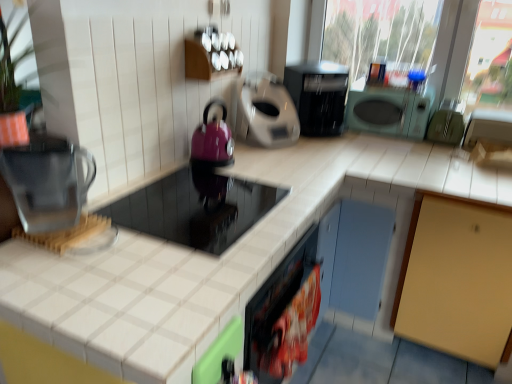
Question: From the image's perspective, is matte purple kettle at center-left, acting as the second appliance starting from the left, above shiny black cooktop at center, marked as the sixth appliance in a right-to-left arrangement?

Choices:
 (A) yes
 (B) no

Answer: (A)

Question: From the image's perspective, would you say matte purple kettle at center-left, the 5th appliance from the right, is shown under shiny black cooktop at center, the first appliance from the left?

Choices:
 (A) yes
 (B) no

Answer: (B)

Question: Considering the relative sizes of matte purple kettle at center-left, acting as the second appliance starting from the left, and shiny black cooktop at center, marked as the sixth appliance in a right-to-left arrangement, in the image provided, is matte purple kettle at center-left, acting as the second appliance starting from the left, bigger than shiny black cooktop at center, marked as the sixth appliance in a right-to-left arrangement,?

Choices:
 (A) no
 (B) yes

Answer: (A)

Question: Is matte purple kettle at center-left, acting as the second appliance starting from the left, not close to shiny black cooktop at center, marked as the sixth appliance in a right-to-left arrangement?

Choices:
 (A) no
 (B) yes

Answer: (A)

Question: From a real-world perspective, is matte purple kettle at center-left, acting as the second appliance starting from the left, on top of shiny black cooktop at center, the first appliance from the left?

Choices:
 (A) no
 (B) yes

Answer: (B)

Question: In the image, is white tile countertop at center on the left side or the right side of shiny black cooktop at center, the first appliance from the left?

Choices:
 (A) right
 (B) left

Answer: (B)

Question: Is point (59, 312) positioned closer to the camera than point (193, 208)?

Choices:
 (A) farther
 (B) closer

Answer: (B)

Question: From the image's perspective, is white tile countertop at center above or below shiny black cooktop at center, the first appliance from the left?

Choices:
 (A) above
 (B) below

Answer: (B)

Question: Do you think white tile countertop at center is within shiny black cooktop at center, marked as the sixth appliance in a right-to-left arrangement, or outside of it?

Choices:
 (A) inside
 (B) outside

Answer: (B)

Question: From the image's perspective, is transparent plastic water filter at left positioned above or below matte gray coffee maker at center, acting as the 3th appliance starting from the left?

Choices:
 (A) above
 (B) below

Answer: (B)

Question: Choose the correct answer: Is transparent plastic water filter at left inside matte gray coffee maker at center, the 4th appliance in the right-to-left sequence, or outside it?

Choices:
 (A) outside
 (B) inside

Answer: (A)

Question: Visually, is transparent plastic water filter at left positioned to the left or to the right of matte gray coffee maker at center, acting as the 3th appliance starting from the left?

Choices:
 (A) left
 (B) right

Answer: (A)

Question: In terms of width, does transparent plastic water filter at left look wider or thinner when compared to matte gray coffee maker at center, the 4th appliance in the right-to-left sequence?

Choices:
 (A) wide
 (B) thin

Answer: (B)

Question: From a real-world perspective, is plastic bag of chips at lower center, marked as the 4th appliance in a left-to-right arrangement, positioned above or below shiny black cooktop at center, the first appliance from the left?

Choices:
 (A) below
 (B) above

Answer: (A)

Question: From the image's perspective, is plastic bag of chips at lower center, which is counted as the 3th appliance, starting from the right, positioned above or below shiny black cooktop at center, the first appliance from the left?

Choices:
 (A) above
 (B) below

Answer: (B)